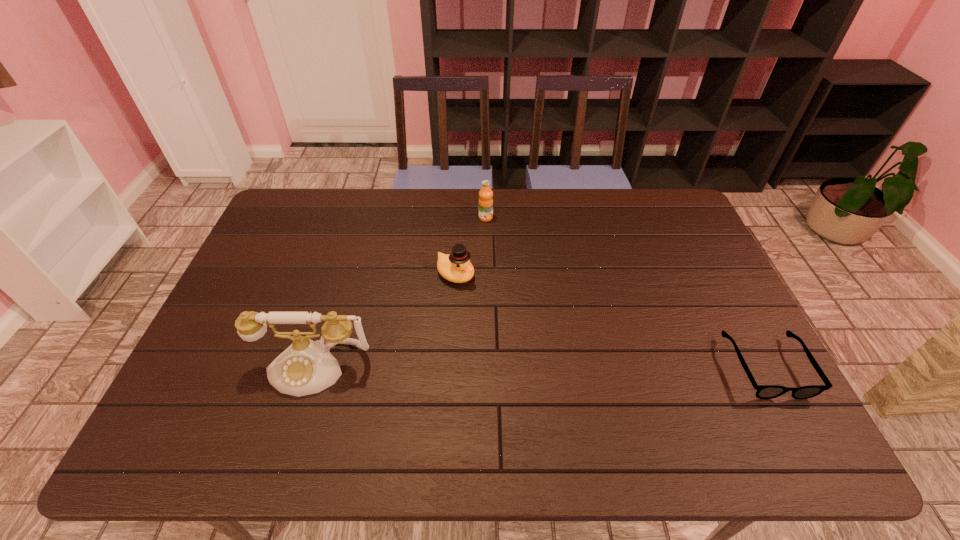
Where is `the leftmost object`? The height and width of the screenshot is (540, 960). the leftmost object is located at coordinates pyautogui.click(x=306, y=367).

Find the location of a particular element. This screenshot has height=540, width=960. telephone is located at coordinates (306, 367).

I want to click on the rightmost object, so click(763, 391).

Locate an element on the screen. spectacles is located at coordinates (763, 391).

Identify the location of the third shortest object. (485, 201).

The height and width of the screenshot is (540, 960). Identify the location of orange juice. (485, 201).

At what (x,y) coordinates should I click in order to perform the action: click on the second farthest object. Please return your answer as a coordinate pair (x, y). This screenshot has height=540, width=960. Looking at the image, I should click on (455, 267).

Find the location of a particular element. The width and height of the screenshot is (960, 540). the third tallest object is located at coordinates (455, 267).

I want to click on vacant space positioned 0.170m on the label of the third shortest object, so click(511, 252).

I want to click on free space located on the label of the third shortest object, so click(521, 266).